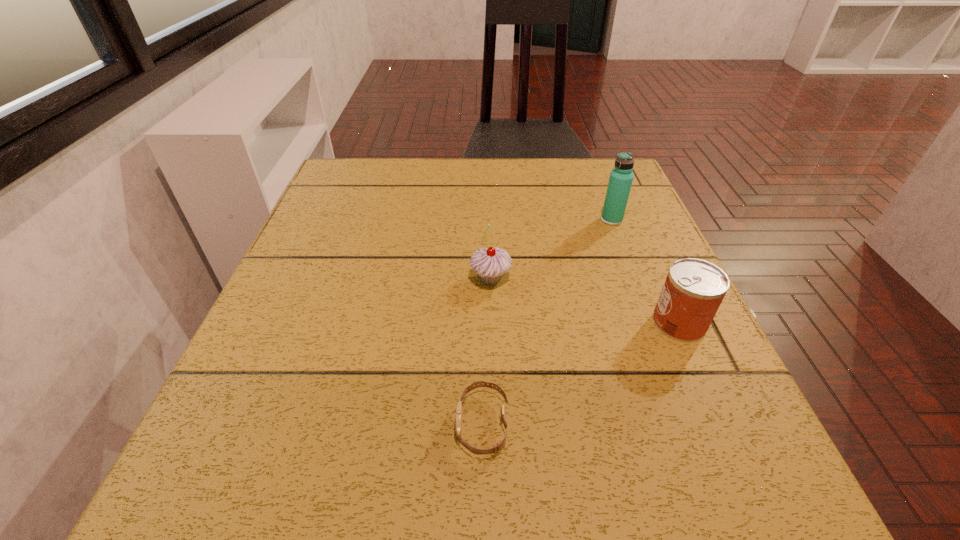
Image resolution: width=960 pixels, height=540 pixels. I want to click on vacant space located on the face of the nearest object, so click(x=315, y=424).

Locate an element on the screen. free space located 0.230m on the face of the nearest object is located at coordinates (294, 424).

Where is `object at the near edge`? This screenshot has width=960, height=540. object at the near edge is located at coordinates (496, 448).

The width and height of the screenshot is (960, 540). Identify the location of thermos bottle located at the right edge. 621,178.

Where is `can present at the right edge`? Image resolution: width=960 pixels, height=540 pixels. can present at the right edge is located at coordinates (693, 290).

Locate an element on the screen. This screenshot has width=960, height=540. free region at the far edge of the desktop is located at coordinates (559, 173).

Locate an element on the screen. blank space at the near edge of the desktop is located at coordinates pyautogui.click(x=485, y=461).

Image resolution: width=960 pixels, height=540 pixels. In order to click on free spot at the left edge of the desktop in this screenshot , I will do `click(275, 394)`.

Where is `vacant space at the right edge of the desktop`? vacant space at the right edge of the desktop is located at coordinates (594, 252).

In the image, there is a desktop. In order to click on vacant space at the far right corner in this screenshot , I will do `click(581, 160)`.